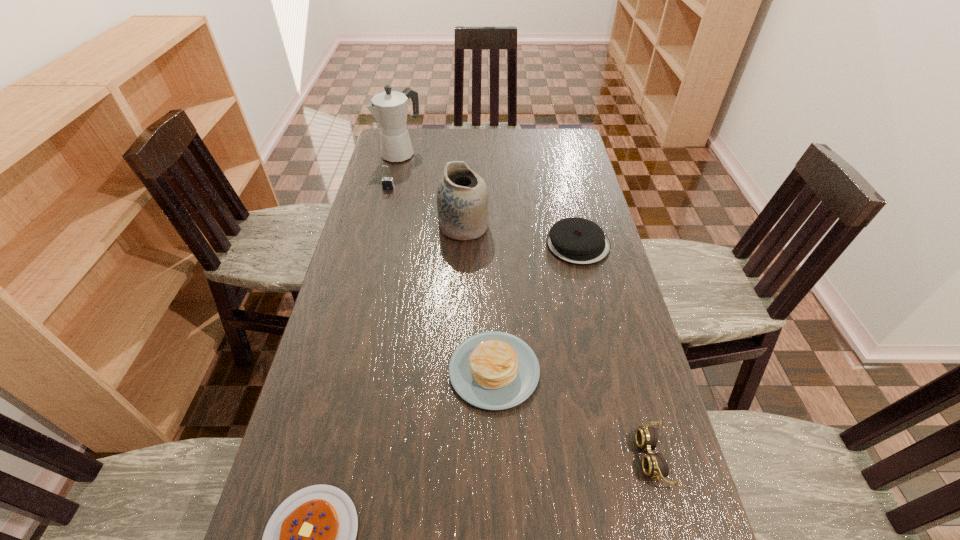
The image size is (960, 540). I want to click on coffeepot, so click(x=389, y=108).

This screenshot has height=540, width=960. Identify the location of the tallest object. [389, 108].

The image size is (960, 540). Identify the location of pottery. [462, 195].

The width and height of the screenshot is (960, 540). Find the location of `the third tallest object`. the third tallest object is located at coordinates (387, 182).

Locate an element on the screen. the sixth nearest object is located at coordinates (387, 182).

This screenshot has width=960, height=540. What are the coordinates of `the farthest pancake` in the screenshot? It's located at (578, 241).

The height and width of the screenshot is (540, 960). Find the location of `the second nearest pancake`. the second nearest pancake is located at coordinates (493, 370).

Find the location of a particular element. The width and height of the screenshot is (960, 540). the third nearest object is located at coordinates (493, 370).

Where is `goggles`? This screenshot has width=960, height=540. goggles is located at coordinates (654, 465).

The image size is (960, 540). What are the coordinates of `free spot located on the front of the farthest object` in the screenshot? It's located at (393, 188).